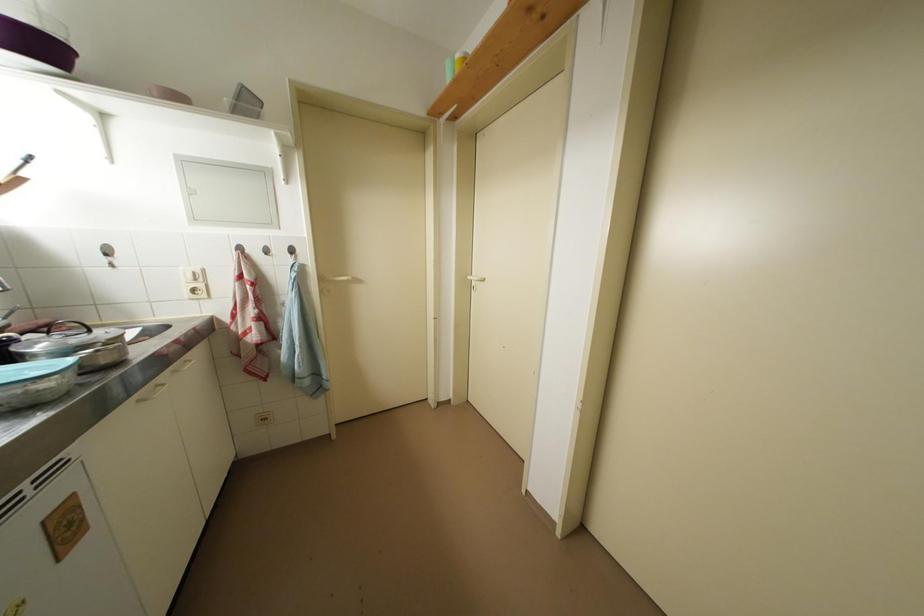
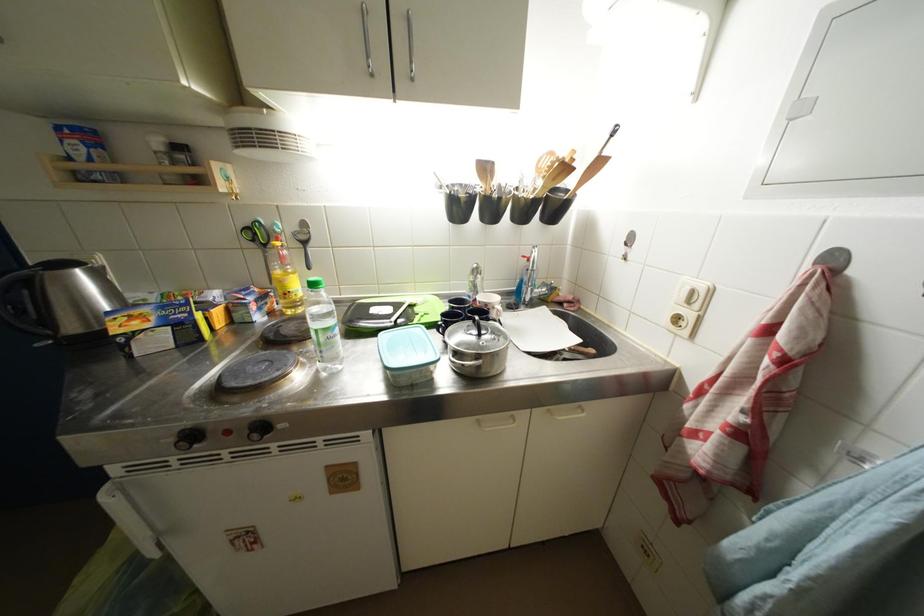
Where in the second image is the point corresponding to the point at 202,283 from the first image?

(696, 306)